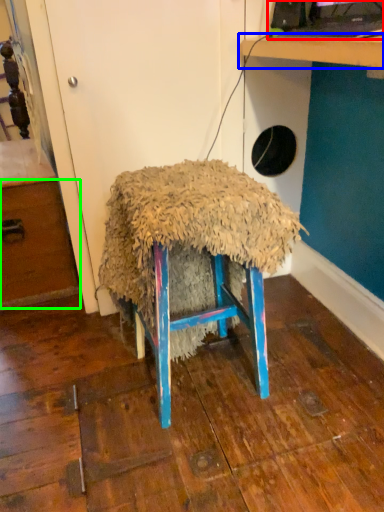
Question: Estimate the real-world distances between objects in this image. Which object is closer to desktop computer (highlighted by a red box), table (highlighted by a blue box) or drawer (highlighted by a green box)?

Choices:
 (A) table
 (B) drawer

Answer: (A)